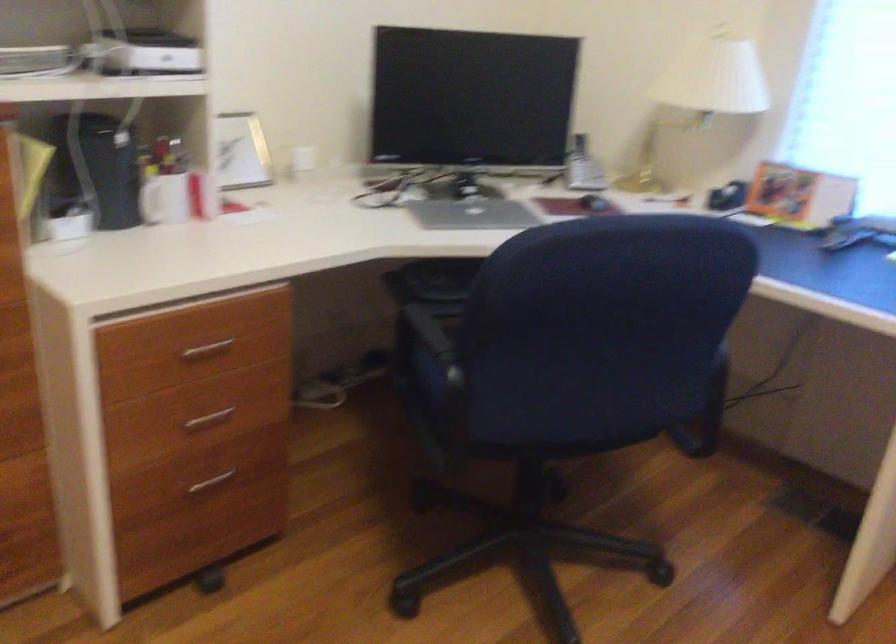
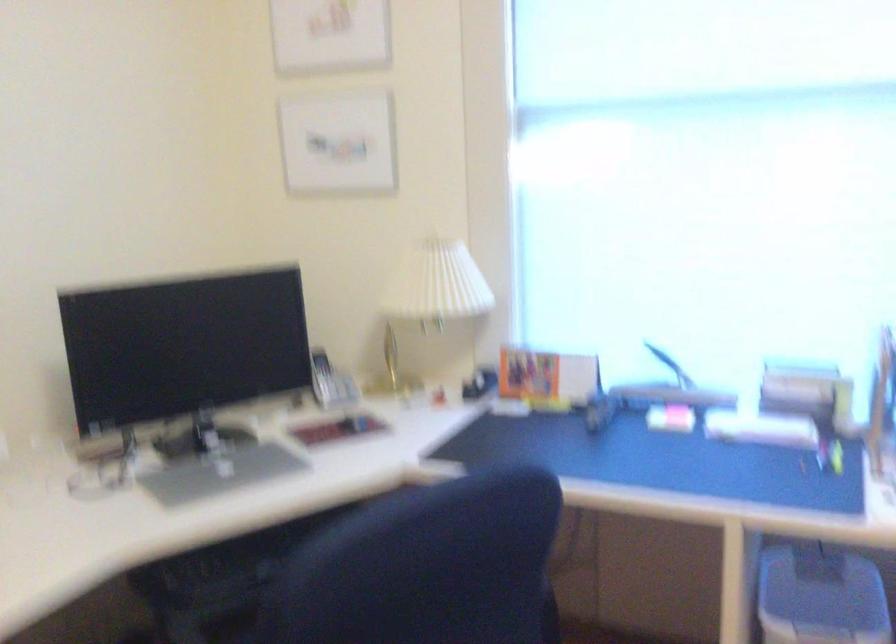
Question: The images are taken continuously from a first-person perspective. In which direction is your viewpoint rotating?

Choices:
 (A) Left
 (B) Right
 (C) Up
 (D) Down

Answer: (B)